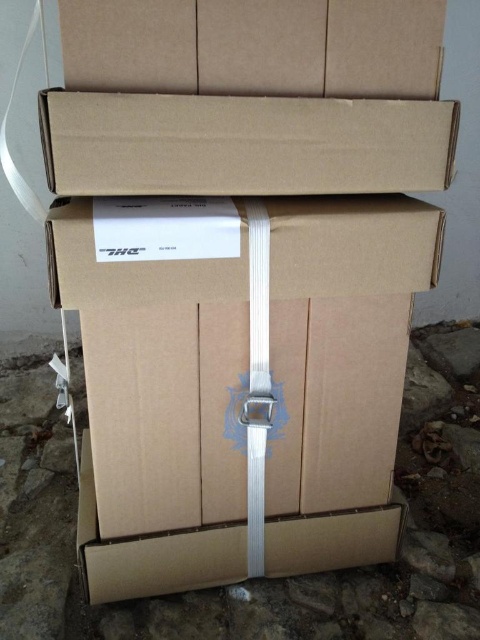
Question: Is brown cardboard box at center thinner than brown cardboard box at upper center?

Choices:
 (A) yes
 (B) no

Answer: (B)

Question: Can you confirm if brown cardboard box at center is smaller than brown cardboard box at upper center?

Choices:
 (A) yes
 (B) no

Answer: (B)

Question: Which point appears closest to the camera in this image?

Choices:
 (A) (51, 116)
 (B) (252, 454)

Answer: (A)

Question: Observing the image, what is the correct spatial positioning of brown cardboard box at center in reference to brown cardboard box at upper center?

Choices:
 (A) right
 (B) left

Answer: (B)

Question: Which object is farther from the camera taking this photo?

Choices:
 (A) brown cardboard box at upper center
 (B) brown cardboard box at center

Answer: (B)